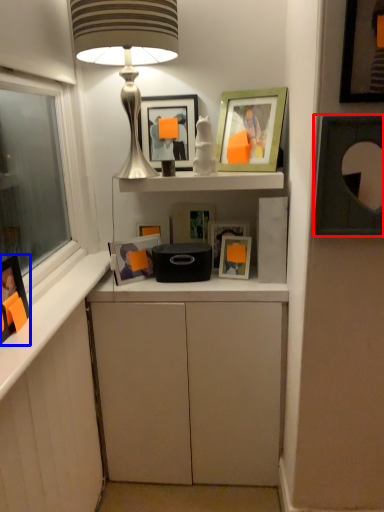
Question: Which object appears farthest to the camera in this image, picture frame (highlighted by a red box) or picture frame (highlighted by a blue box)?

Choices:
 (A) picture frame
 (B) picture frame

Answer: (A)